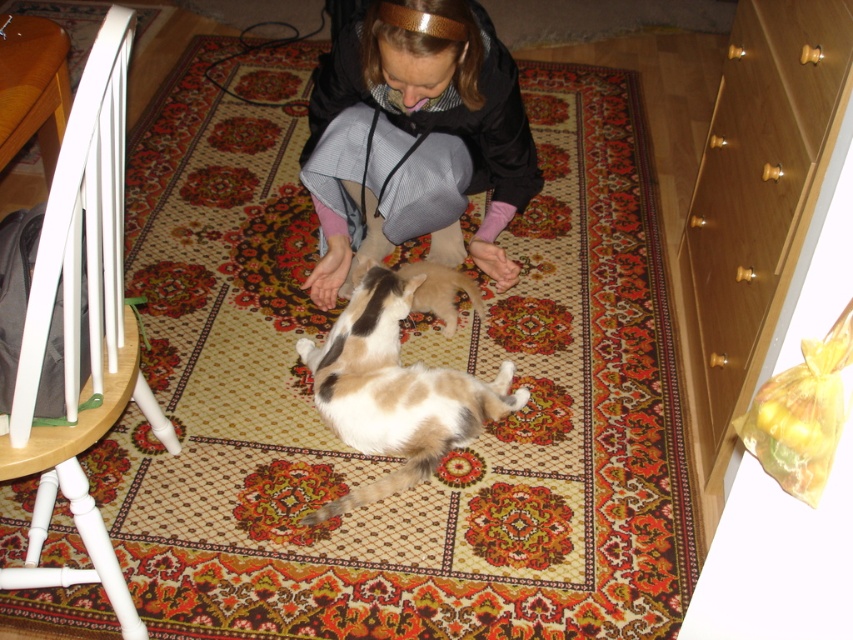
You are organizing a small toy car that is 10 cm long. You have two options to store it in the scene shown. The first option is placing it on the light brown wood drawer at right, and the second is placing it on the black hoodie at center. Considering their sizes, which object would be a better fit for the toy car?

The light brown wood drawer at right is smaller than the black hoodie at center. Therefore, the black hoodie at center would provide a more stable and spacious surface for the 10 cm toy car.

You are a cat owner who wants to place a small toy on the light brown wood drawer at right so that the brown and white fur cat at center can reach it. Based on their heights, do you think the cat can reach the toy?

The light brown wood drawer at right is much taller than the brown and white fur cat at center, so the cat cannot reach the toy placed there.

You are a cat owner who wants to place a small toy between the light brown wood drawer at right and the brown and white fur cat at center. Which object is narrower so you can position the toy closer to it?

The light brown wood drawer at right is thinner than the brown and white fur cat at center, so you should place the toy closer to the drawer since it has less width.